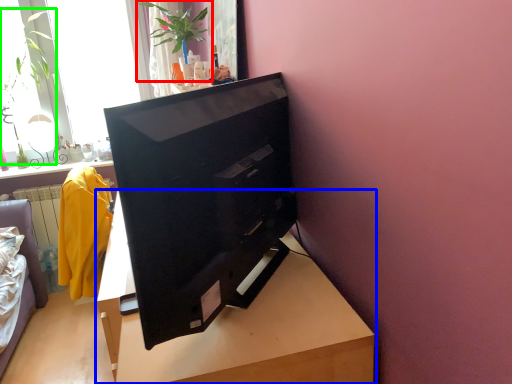
Question: Based on their relative distances, which object is nearer to houseplant (highlighted by a red box)? Choose from table (highlighted by a blue box) and plant (highlighted by a green box).

Choices:
 (A) table
 (B) plant

Answer: (B)